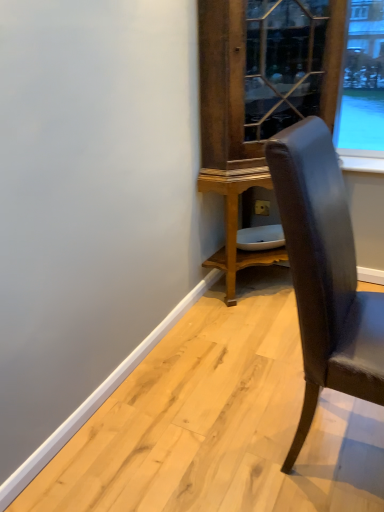
I want to click on wooden glossy dresser at center, so click(258, 103).

The width and height of the screenshot is (384, 512). What do you see at coordinates (258, 103) in the screenshot?
I see `wooden glossy dresser at center` at bounding box center [258, 103].

Where is `leather chair at right`? The image size is (384, 512). leather chair at right is located at coordinates (325, 273).

This screenshot has width=384, height=512. Describe the element at coordinates (325, 273) in the screenshot. I see `leather chair at right` at that location.

Locate an element on the screen. The width and height of the screenshot is (384, 512). wooden glossy dresser at center is located at coordinates (258, 103).

Does leather chair at right appear on the right side of wooden glossy dresser at center?

Yes.

Considering their positions, is leather chair at right located in front of or behind wooden glossy dresser at center?

leather chair at right is positioned closer to the viewer than wooden glossy dresser at center.

Is point (346, 387) positioned before point (262, 106)?

Yes, it is in front of point (262, 106).

From the image's perspective, would you say leather chair at right is positioned over wooden glossy dresser at center?

No, from the image's perspective, leather chair at right is not on top of wooden glossy dresser at center.

From a real-world perspective, does leather chair at right stand above wooden glossy dresser at center?

Actually, leather chair at right is physically below wooden glossy dresser at center in the real world.

Looking at their sizes, would you say leather chair at right is wider or thinner than wooden glossy dresser at center?

Clearly, leather chair at right has less width compared to wooden glossy dresser at center.

Considering the sizes of leather chair at right and wooden glossy dresser at center in the image, is leather chair at right taller or shorter than wooden glossy dresser at center?

Clearly, leather chair at right is shorter compared to wooden glossy dresser at center.

Considering the relative sizes of leather chair at right and wooden glossy dresser at center in the image provided, is leather chair at right bigger than wooden glossy dresser at center?

Actually, leather chair at right might be smaller than wooden glossy dresser at center.

Is leather chair at right positioned beyond the bounds of wooden glossy dresser at center?

Indeed, leather chair at right is completely outside wooden glossy dresser at center.

Is leather chair at right beside wooden glossy dresser at center?

No, leather chair at right is not touching wooden glossy dresser at center.

Looking at this image, does leather chair at right turn towards wooden glossy dresser at center?

No, leather chair at right does not turn towards wooden glossy dresser at center.

The width and height of the screenshot is (384, 512). I want to click on chair lying in front of the wooden glossy dresser at center, so click(325, 273).

Considering the relative positions of wooden glossy dresser at center and leather chair at right in the image provided, is wooden glossy dresser at center to the left of leather chair at right from the viewer's perspective?

Yes, wooden glossy dresser at center is to the left of leather chair at right.

Considering the positions of objects wooden glossy dresser at center and leather chair at right in the image provided, who is in front, wooden glossy dresser at center or leather chair at right?

leather chair at right.

Between point (229, 127) and point (309, 202), which one is positioned behind?

Point (229, 127)

From the image's perspective, which object appears higher, wooden glossy dresser at center or leather chair at right?

wooden glossy dresser at center is shown above in the image.

From a real-world perspective, is wooden glossy dresser at center above or below leather chair at right?

From a real-world perspective, wooden glossy dresser at center is physically above leather chair at right.

Can you confirm if wooden glossy dresser at center is thinner than leather chair at right?

No, wooden glossy dresser at center is not thinner than leather chair at right.

Is wooden glossy dresser at center shorter than leather chair at right?

In fact, wooden glossy dresser at center may be taller than leather chair at right.

Consider the image. Considering the sizes of objects wooden glossy dresser at center and leather chair at right in the image provided, who is smaller, wooden glossy dresser at center or leather chair at right?

leather chair at right is smaller.

Is leather chair at right a part of wooden glossy dresser at center?

That's incorrect, leather chair at right is not inside wooden glossy dresser at center.

Are wooden glossy dresser at center and leather chair at right beside each other?

No, wooden glossy dresser at center is not making contact with leather chair at right.

Is wooden glossy dresser at center facing away from leather chair at right?

No, wooden glossy dresser at center is not facing away from leather chair at right.

Where is `chair on the right of wooden glossy dresser at center`? The height and width of the screenshot is (512, 384). chair on the right of wooden glossy dresser at center is located at coordinates (325, 273).

Where is `chair below the wooden glossy dresser at center (from the image's perspective)`? This screenshot has height=512, width=384. chair below the wooden glossy dresser at center (from the image's perspective) is located at coordinates point(325,273).

In order to click on chair on the right of wooden glossy dresser at center in this screenshot , I will do `click(325, 273)`.